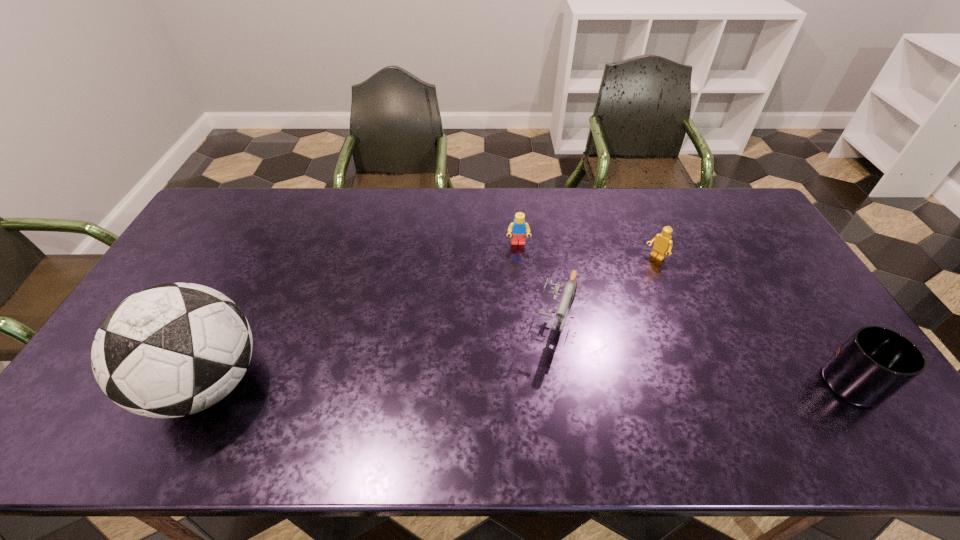
In order to click on soccer ball in this screenshot , I will do `click(171, 350)`.

Where is `the leftmost object`? The width and height of the screenshot is (960, 540). the leftmost object is located at coordinates (171, 350).

You are a GUI agent. You are given a task and a screenshot of the screen. Output one action in this format:
    pyautogui.click(x=<x>, y=<y>)
    Task: Click on the mug
    The height and width of the screenshot is (540, 960).
    Given the screenshot: What is the action you would take?
    click(x=876, y=362)

The width and height of the screenshot is (960, 540). I want to click on gun, so click(x=568, y=296).

Where is `the second farthest object`? The height and width of the screenshot is (540, 960). the second farthest object is located at coordinates (663, 244).

Where is `the right Lego`? This screenshot has height=540, width=960. the right Lego is located at coordinates (663, 244).

Find the location of a particular element. The width and height of the screenshot is (960, 540). the farthest object is located at coordinates (518, 228).

Where is `the farther Lego`? Image resolution: width=960 pixels, height=540 pixels. the farther Lego is located at coordinates (518, 228).

In order to click on vacant area situated on the surface of the leftmost object where the brand logo is visible in this screenshot , I will do `click(115, 384)`.

The image size is (960, 540). In order to click on free space located on the surface of the leftmost object where the brand logo is visible in this screenshot , I will do `click(100, 384)`.